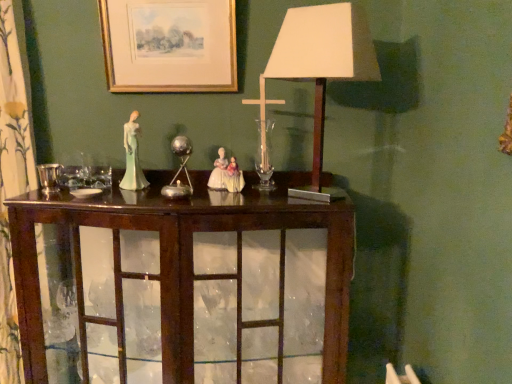
You are a GUI agent. You are given a task and a screenshot of the screen. Output one action in this format:
    pyautogui.click(x=<x>, y=<y>)
    Task: Click on the unoccupied area in front of porcelain figure at center
    The width and height of the screenshot is (512, 384).
    Given the screenshot: What is the action you would take?
    pyautogui.click(x=116, y=199)